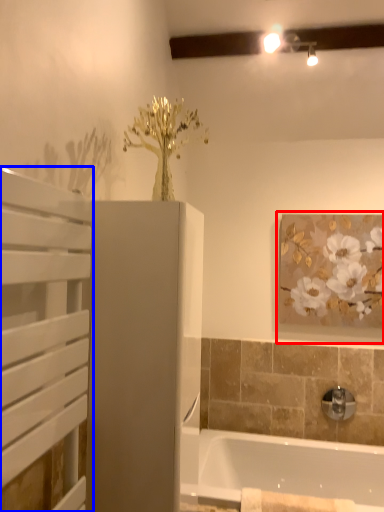
Question: Which object appears farthest to the camera in this image, picture frame (highlighted by a red box) or screen door (highlighted by a blue box)?

Choices:
 (A) picture frame
 (B) screen door

Answer: (A)